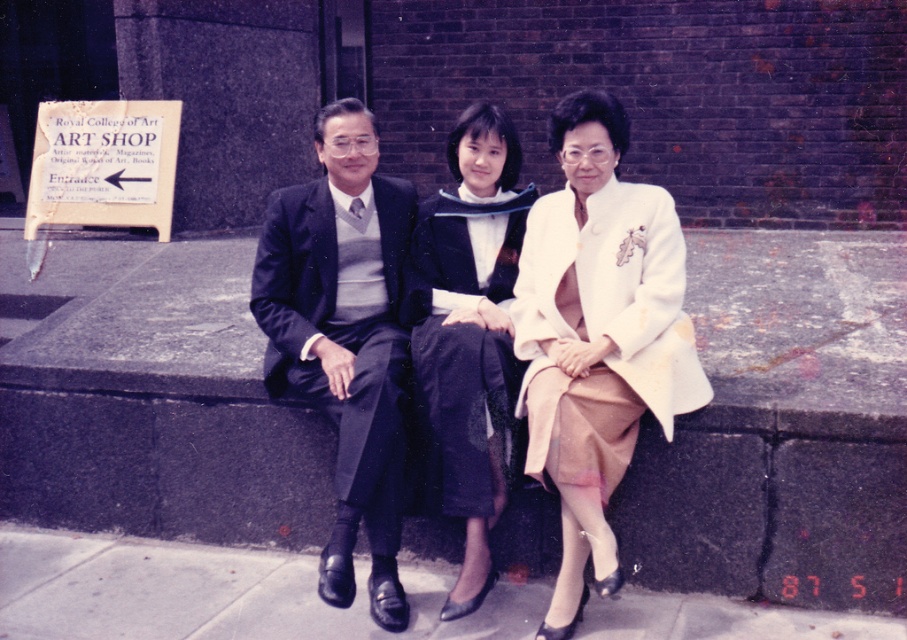
Question: Is smooth concrete pavement at lower center wider than matte black graduation gown at center?

Choices:
 (A) yes
 (B) no

Answer: (A)

Question: Among these objects, which one is farthest from the camera?

Choices:
 (A) matte black graduation gown at center
 (B) white satin jacket at center
 (C) dark blue suit at center

Answer: (A)

Question: Which object is the farthest from the dark blue suit at center?

Choices:
 (A) smooth concrete pavement at lower center
 (B) white satin jacket at center
 (C) matte black graduation gown at center

Answer: (A)

Question: Can you confirm if white satin jacket at center is smaller than matte black graduation gown at center?

Choices:
 (A) yes
 (B) no

Answer: (B)

Question: Does matte black suit at center appear on the right side of white satin jacket at center?

Choices:
 (A) yes
 (B) no

Answer: (B)

Question: Which point appears farthest from the camera in this image?

Choices:
 (A) (451, 394)
 (B) (649, 236)
 (C) (369, 416)
 (D) (574, 422)

Answer: (B)